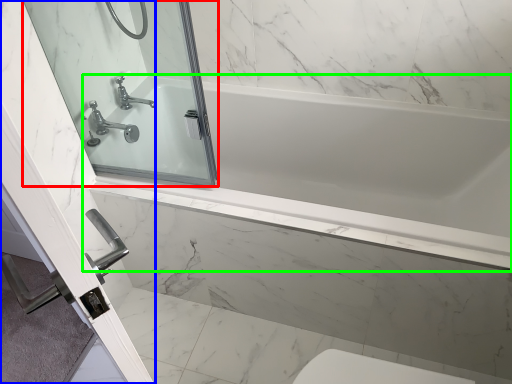
Question: Based on their relative distances, which object is nearer to mirror (highlighted by a red box)? Choose from screen door (highlighted by a blue box) and bathtub (highlighted by a green box).

Choices:
 (A) screen door
 (B) bathtub

Answer: (A)